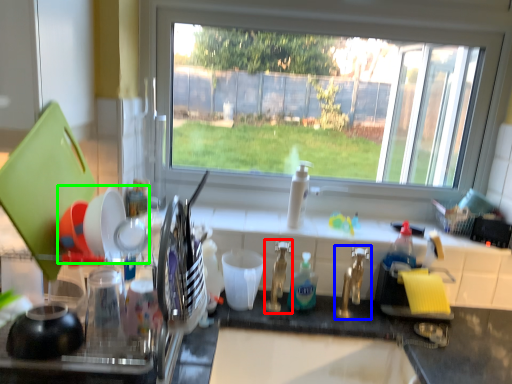
Question: Estimate the real-world distances between objects in this image. Which object is closer to faucet (highlighted by a red box), tap (highlighted by a blue box) or tableware (highlighted by a green box)?

Choices:
 (A) tap
 (B) tableware

Answer: (A)